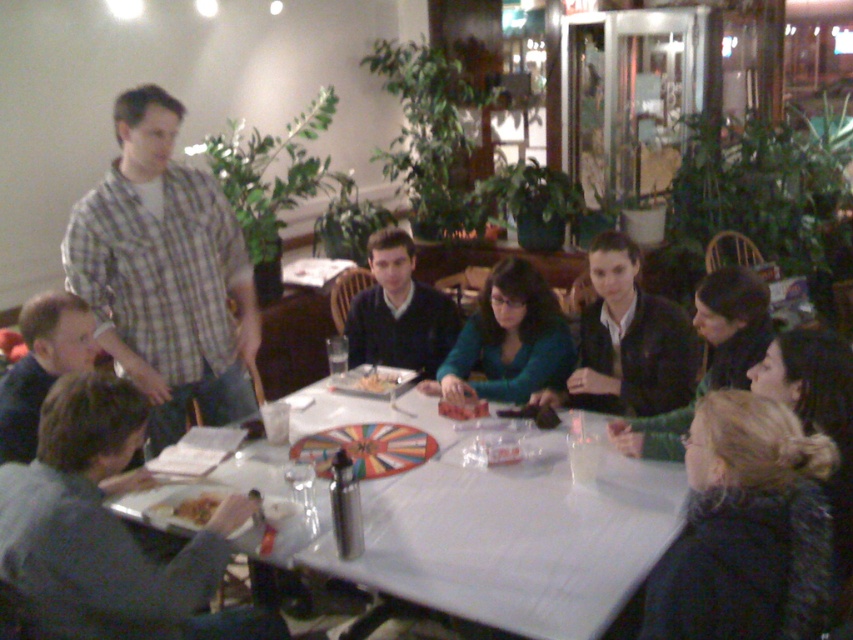
Measure the distance between matte green sweater at center and camera.

The distance of matte green sweater at center from camera is 2.71 meters.

I want to click on matte green sweater at center, so click(x=509, y=339).

Is point (515, 355) in front of point (172, 512)?

No, it is not.

Where is `matte green sweater at center`? This screenshot has width=853, height=640. matte green sweater at center is located at coordinates (509, 339).

Measure the distance between plaid shirt at left and camera.

2.39 meters

Based on the photo, does plaid shirt at left have a greater height compared to smooth plastic spinner at center?

Yes, plaid shirt at left is taller than smooth plastic spinner at center.

Who is more distant from viewer, (128,204) or (393,371)?

The point (393,371) is more distant.

Image resolution: width=853 pixels, height=640 pixels. I want to click on plaid shirt at left, so click(165, 273).

Is black matte jacket at center to the right of smooth plastic fork at center from the viewer's perspective?

Correct, you'll find black matte jacket at center to the right of smooth plastic fork at center.

Measure the distance between black matte jacket at center and smooth plastic fork at center.

They are 20.02 inches apart.

You are a GUI agent. You are given a task and a screenshot of the screen. Output one action in this format:
    pyautogui.click(x=<x>, y=<y>)
    Task: Click on the black matte jacket at center
    
    Given the screenshot: What is the action you would take?
    pyautogui.click(x=625, y=340)

The width and height of the screenshot is (853, 640). Identify the location of black matte jacket at center. 625,340.